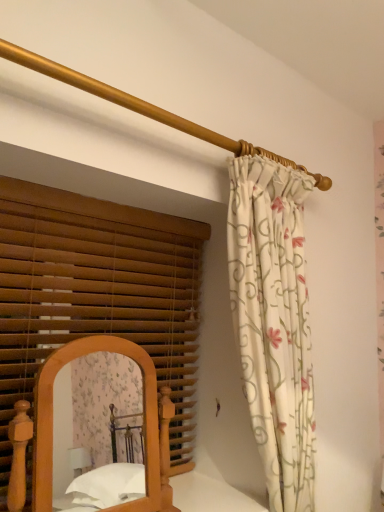
Question: Is point (97, 471) closer or farther from the camera than point (173, 119)?

Choices:
 (A) closer
 (B) farther

Answer: (B)

Question: From the image's perspective, is wooden bed at lower left above or below gold polished rod at upper center?

Choices:
 (A) above
 (B) below

Answer: (B)

Question: Which object is positioned farthest from the floral fabric curtain at upper right?

Choices:
 (A) wooden blinds at left
 (B) wooden bed at lower left
 (C) gold polished rod at upper center

Answer: (B)

Question: Based on their relative distances, which object is nearer to the floral fabric curtain at upper right?

Choices:
 (A) wooden blinds at left
 (B) wooden bed at lower left
 (C) gold polished rod at upper center

Answer: (C)